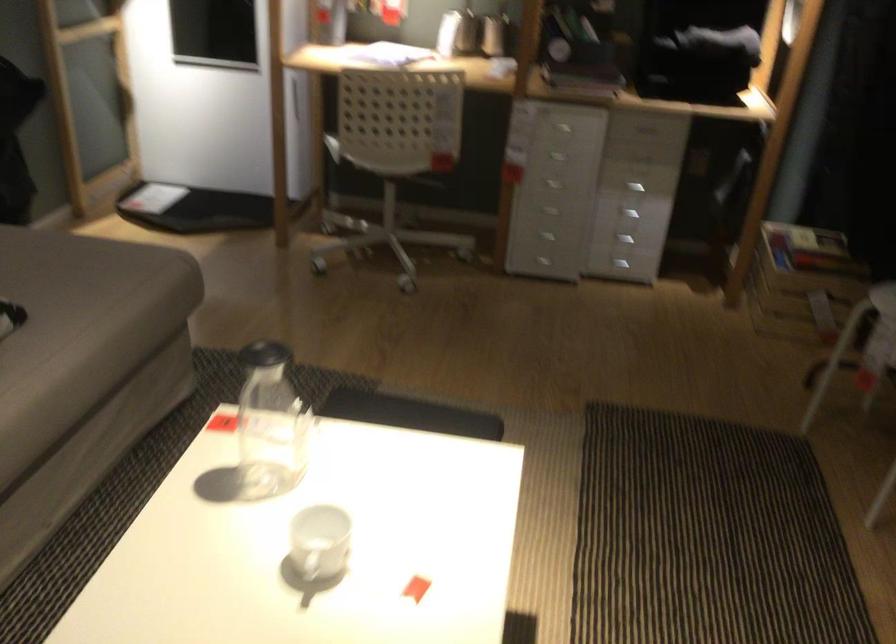
Where would you lift the glass pitcher? Please return your answer as a coordinate pair (x, y).

(270, 424)